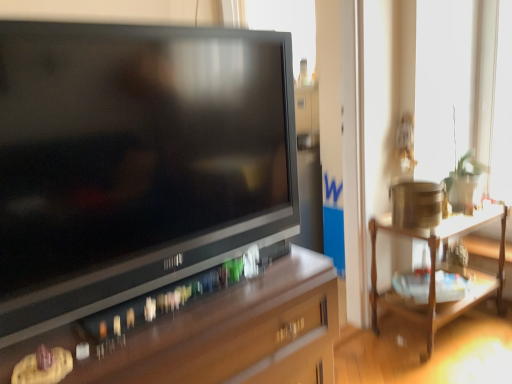
Find the location of a particular element. This screenshot has height=384, width=512. free space above brown wood desk at lower left (from a real-world perspective) is located at coordinates (174, 309).